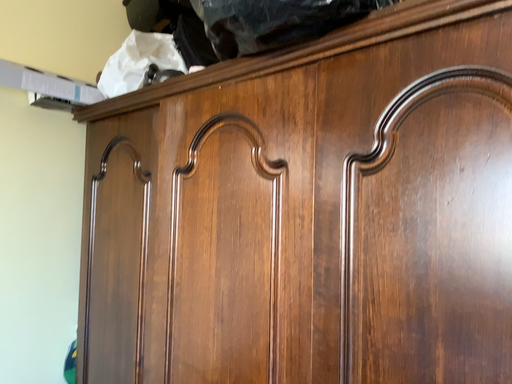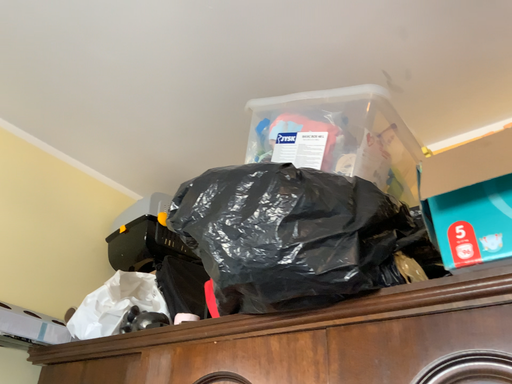
Question: Which way did the camera rotate in the video?

Choices:
 (A) rotated right
 (B) rotated left

Answer: (A)